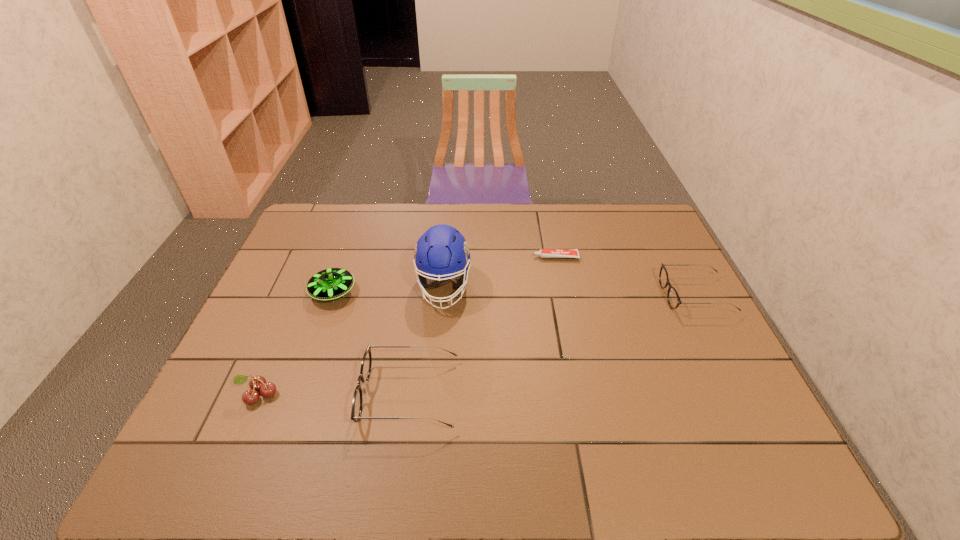
Identify which object is the closest to the saucer. Please provide its 2D coordinates. Your answer should be formatted as a tuple, i.e. [(x, y)], where the tuple contains the x and y coordinates of a point satisfying the conditions above.

[(442, 251)]

Identify the location of object that stands as the second closest to the rightmost object. tap(442, 251).

In order to click on vacant space that satisfies the following two spatial constraints: 1. on the front-facing side of the football helmet; 2. through the lenses of the left spectacles in this screenshot , I will do `click(434, 394)`.

The height and width of the screenshot is (540, 960). I want to click on blank space that satisfies the following two spatial constraints: 1. at the nozzle of the shortest object; 2. on the leaves of the cherry, so click(584, 394).

You are a GUI agent. You are given a task and a screenshot of the screen. Output one action in this format:
    pyautogui.click(x=<x>, y=<y>)
    Task: Click on the vacant point that satisfies the following two spatial constraints: 1. at the nozzle of the farthest object; 2. on the front side of the saucer
    This screenshot has height=540, width=960.
    Given the screenshot: What is the action you would take?
    pyautogui.click(x=563, y=292)